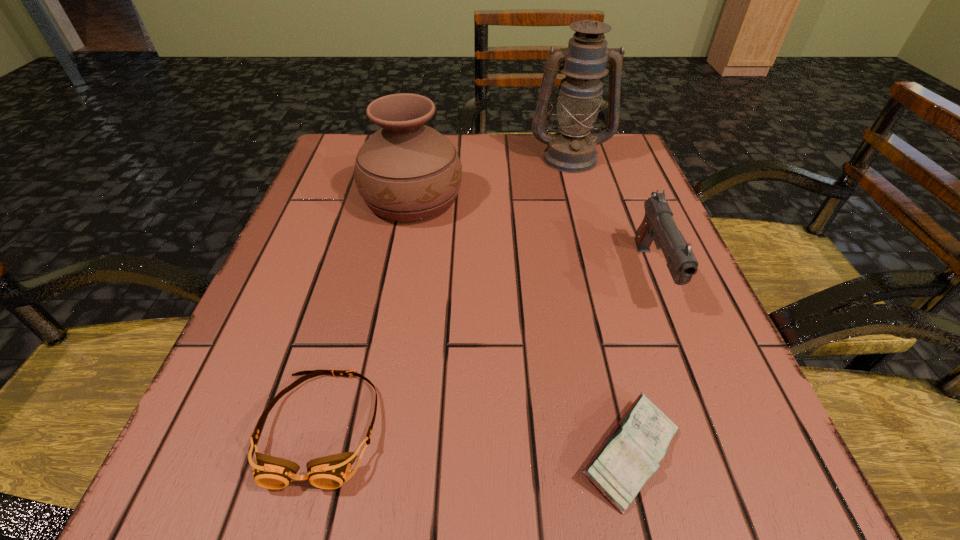
This screenshot has width=960, height=540. In order to click on vacant area that lies between the diary and the gun in this screenshot , I will do `click(641, 363)`.

Identify the location of blank region between the second tallest object and the gun. The image size is (960, 540). (533, 235).

Locate an element on the screen. free spot between the diary and the gun is located at coordinates (641, 363).

Locate an element on the screen. free point between the goggles and the third shortest object is located at coordinates (487, 350).

The image size is (960, 540). I want to click on vacant space in between the tallest object and the diary, so click(600, 305).

Where is `vacant area that lies between the urn and the tallest object`? This screenshot has width=960, height=540. vacant area that lies between the urn and the tallest object is located at coordinates (491, 178).

Locate an element on the screen. The height and width of the screenshot is (540, 960). free spot between the fourth shortest object and the diary is located at coordinates (521, 326).

You are a GUI agent. You are given a task and a screenshot of the screen. Output one action in this format:
    pyautogui.click(x=<x>, y=<y>)
    Task: Click on the object that stands as the second closest to the diary
    
    Given the screenshot: What is the action you would take?
    330,472

At what (x,y) coordinates should I click in order to perform the action: click on object that is the closest one to the goggles. Please return your answer as a coordinate pair (x, y). This screenshot has height=540, width=960. Looking at the image, I should click on [630, 455].

Identify the location of free location that satisfies the following two spatial constraints: 1. with the lenses facing forward on the diary; 2. on the right side of the goggles. Image resolution: width=960 pixels, height=540 pixels. (315, 454).